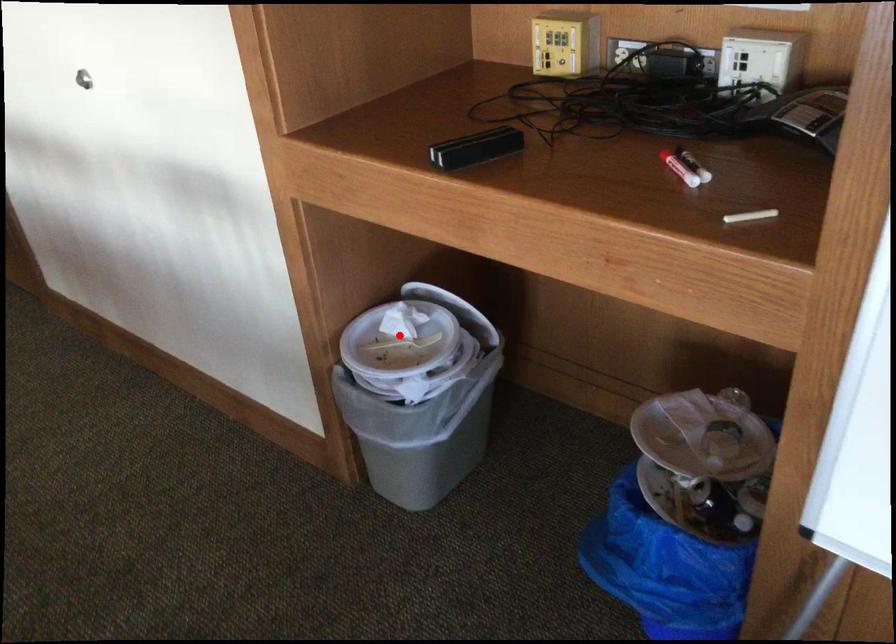
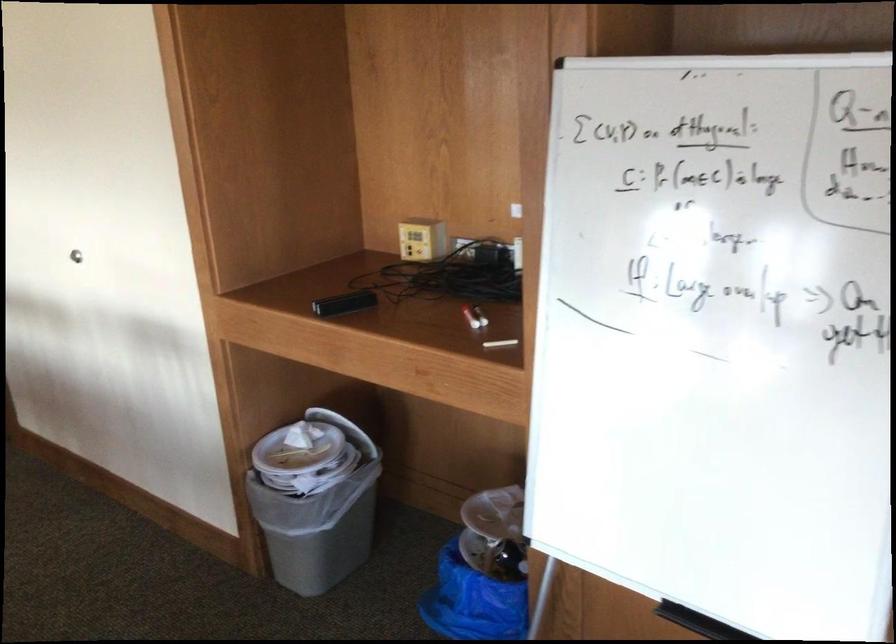
Question: I am providing you with two images of the same scene from different viewpoints. Image1 has a red point marked. In image2, the corresponding 3D location appears at what relative position? Reply with the corresponding letter.

Choices:
 (A) Closer
 (B) Farther

Answer: (B)